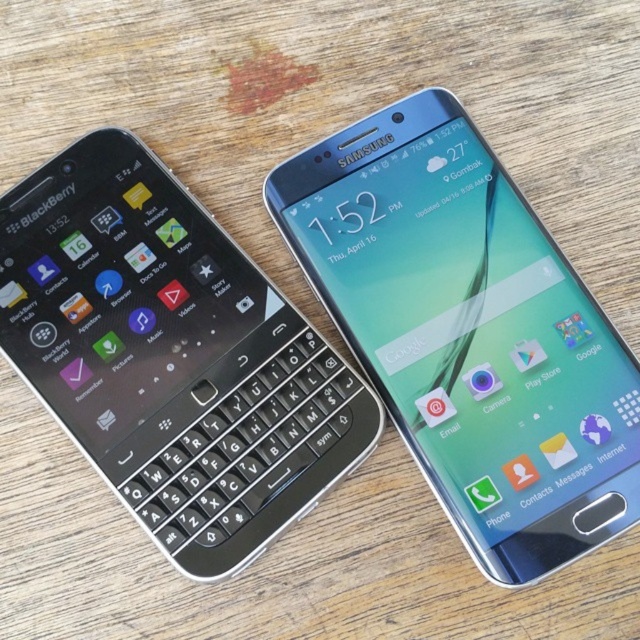
You are setting up a phone stand to display both the sleek silver phone at upper right and the black plastic keyboard at left. Which phone should you place higher to ensure both are visible?

The sleek silver phone at upper right is much taller than the black plastic keyboard at left, so you should place the sleek silver phone at upper right higher to ensure both are visible.